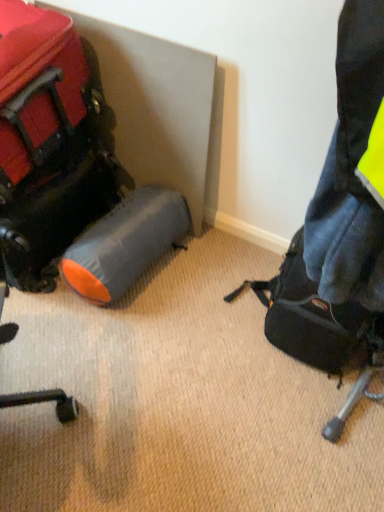
This screenshot has height=512, width=384. Describe the element at coordinates (49, 143) in the screenshot. I see `matte black suitcase at left, which ranks as the 2th luggage and bags in right-to-left order` at that location.

The width and height of the screenshot is (384, 512). In order to click on matte black backpack at right, the 1th luggage and bags positioned from the right in this screenshot , I will do `click(313, 318)`.

At what (x,y) coordinates should I click in order to perform the action: click on matte black suitcase at left, marked as the first luggage and bags in a left-to-right arrangement. Please return your answer as a coordinate pair (x, y). The image size is (384, 512). Looking at the image, I should click on [x=49, y=143].

Who is taller, matte black suitcase at left, marked as the first luggage and bags in a left-to-right arrangement, or gray fabric sleeping bag at lower left?

Standing taller between the two is matte black suitcase at left, marked as the first luggage and bags in a left-to-right arrangement.

From a real-world perspective, between matte black suitcase at left, marked as the first luggage and bags in a left-to-right arrangement, and gray fabric sleeping bag at lower left, who is vertically lower?

gray fabric sleeping bag at lower left.

Looking at this image, what's the angular difference between matte black suitcase at left, marked as the first luggage and bags in a left-to-right arrangement, and gray fabric sleeping bag at lower left's facing directions?

1.65 degrees.

Is matte black suitcase at left, which ranks as the 2th luggage and bags in right-to-left order, located outside gray fabric sleeping bag at lower left?

Yes, matte black suitcase at left, which ranks as the 2th luggage and bags in right-to-left order, is outside of gray fabric sleeping bag at lower left.

Locate an element on the screen. Image resolution: width=384 pixels, height=512 pixels. luggage below the matte black suitcase at left, marked as the first luggage and bags in a left-to-right arrangement (from the image's perspective) is located at coordinates (125, 243).

From a real-world perspective, between gray fabric sleeping bag at lower left and matte black suitcase at left, which ranks as the 2th luggage and bags in right-to-left order, who is vertically lower?

gray fabric sleeping bag at lower left, from a real-world perspective.

Can you confirm if gray fabric sleeping bag at lower left is wider than matte black suitcase at left, which ranks as the 2th luggage and bags in right-to-left order?

No.

Locate an element on the screen. The image size is (384, 512). luggage and bags above the matte black backpack at right, the 1th luggage and bags positioned from the right (from the image's perspective) is located at coordinates (49, 143).

Which of these two, matte black suitcase at left, marked as the first luggage and bags in a left-to-right arrangement, or matte black backpack at right, the 1th luggage and bags positioned from the right, stands shorter?

matte black backpack at right, the 1th luggage and bags positioned from the right, is shorter.

Is matte black suitcase at left, which ranks as the 2th luggage and bags in right-to-left order, to the left or to the right of matte black backpack at right, the 1th luggage and bags positioned from the right, in the image?

matte black suitcase at left, which ranks as the 2th luggage and bags in right-to-left order, is to the left of matte black backpack at right, the 1th luggage and bags positioned from the right.

Is matte black suitcase at left, which ranks as the 2th luggage and bags in right-to-left order, oriented away from matte black backpack at right, positioned as the 2th luggage and bags in left-to-right order?

That's not correct — matte black suitcase at left, which ranks as the 2th luggage and bags in right-to-left order, is not looking away from matte black backpack at right, positioned as the 2th luggage and bags in left-to-right order.

Can you confirm if matte black backpack at right, the 1th luggage and bags positioned from the right, is wider than matte black suitcase at left, which ranks as the 2th luggage and bags in right-to-left order?

No, matte black backpack at right, the 1th luggage and bags positioned from the right, is not wider than matte black suitcase at left, which ranks as the 2th luggage and bags in right-to-left order.

From a real-world perspective, does matte black backpack at right, positioned as the 2th luggage and bags in left-to-right order, stand above matte black suitcase at left, marked as the first luggage and bags in a left-to-right arrangement?

Actually, matte black backpack at right, positioned as the 2th luggage and bags in left-to-right order, is physically below matte black suitcase at left, marked as the first luggage and bags in a left-to-right arrangement, in the real world.

Does matte black backpack at right, positioned as the 2th luggage and bags in left-to-right order, contain matte black suitcase at left, which ranks as the 2th luggage and bags in right-to-left order?

Definitely not — matte black suitcase at left, which ranks as the 2th luggage and bags in right-to-left order, is not inside matte black backpack at right, positioned as the 2th luggage and bags in left-to-right order.

Considering the points (313, 328) and (112, 276), which point is in front, point (313, 328) or point (112, 276)?

Positioned in front is point (313, 328).

Is matte black backpack at right, positioned as the 2th luggage and bags in left-to-right order, wider than gray fabric sleeping bag at lower left?

No, matte black backpack at right, positioned as the 2th luggage and bags in left-to-right order, is not wider than gray fabric sleeping bag at lower left.

Considering the sizes of matte black backpack at right, positioned as the 2th luggage and bags in left-to-right order, and gray fabric sleeping bag at lower left in the image, is matte black backpack at right, positioned as the 2th luggage and bags in left-to-right order, bigger or smaller than gray fabric sleeping bag at lower left?

Considering their sizes, matte black backpack at right, positioned as the 2th luggage and bags in left-to-right order, takes up more space than gray fabric sleeping bag at lower left.

Is matte black backpack at right, positioned as the 2th luggage and bags in left-to-right order, placed right next to gray fabric sleeping bag at lower left?

No, matte black backpack at right, positioned as the 2th luggage and bags in left-to-right order, is not touching gray fabric sleeping bag at lower left.

Is there a large distance between gray fabric sleeping bag at lower left and matte black backpack at right, the 1th luggage and bags positioned from the right?

No.

Is gray fabric sleeping bag at lower left positioned before matte black backpack at right, the 1th luggage and bags positioned from the right?

No, the depth of gray fabric sleeping bag at lower left is greater than that of matte black backpack at right, the 1th luggage and bags positioned from the right.

Considering the relative positions of gray fabric sleeping bag at lower left and matte black backpack at right, positioned as the 2th luggage and bags in left-to-right order, in the image provided, is gray fabric sleeping bag at lower left to the right of matte black backpack at right, positioned as the 2th luggage and bags in left-to-right order, from the viewer's perspective?

In fact, gray fabric sleeping bag at lower left is to the left of matte black backpack at right, positioned as the 2th luggage and bags in left-to-right order.

Find the location of a particular element. luggage and bags lying below the gray fabric sleeping bag at lower left (from the image's perspective) is located at coordinates (313, 318).

Where is `luggage behind the matte black suitcase at left, marked as the first luggage and bags in a left-to-right arrangement`? Image resolution: width=384 pixels, height=512 pixels. luggage behind the matte black suitcase at left, marked as the first luggage and bags in a left-to-right arrangement is located at coordinates (125, 243).

Where is `luggage on the right of matte black suitcase at left, marked as the first luggage and bags in a left-to-right arrangement`? Image resolution: width=384 pixels, height=512 pixels. luggage on the right of matte black suitcase at left, marked as the first luggage and bags in a left-to-right arrangement is located at coordinates (125, 243).

Considering their positions, is matte black suitcase at left, marked as the first luggage and bags in a left-to-right arrangement, positioned closer to gray fabric sleeping bag at lower left than matte black backpack at right, positioned as the 2th luggage and bags in left-to-right order?

Among the two, matte black suitcase at left, marked as the first luggage and bags in a left-to-right arrangement, is located nearer to gray fabric sleeping bag at lower left.

Estimate the real-world distances between objects in this image. Which object is further from matte black suitcase at left, which ranks as the 2th luggage and bags in right-to-left order, matte black backpack at right, positioned as the 2th luggage and bags in left-to-right order, or gray fabric sleeping bag at lower left?

The object further to matte black suitcase at left, which ranks as the 2th luggage and bags in right-to-left order, is matte black backpack at right, positioned as the 2th luggage and bags in left-to-right order.

Consider the image. Which object lies nearer to the anchor point matte black backpack at right, the 1th luggage and bags positioned from the right, gray fabric sleeping bag at lower left or matte black suitcase at left, marked as the first luggage and bags in a left-to-right arrangement?

Among the two, gray fabric sleeping bag at lower left is located nearer to matte black backpack at right, the 1th luggage and bags positioned from the right.

Which object lies further to the anchor point matte black backpack at right, positioned as the 2th luggage and bags in left-to-right order, matte black suitcase at left, which ranks as the 2th luggage and bags in right-to-left order, or gray fabric sleeping bag at lower left?

matte black suitcase at left, which ranks as the 2th luggage and bags in right-to-left order, is further to matte black backpack at right, positioned as the 2th luggage and bags in left-to-right order.

Based on their spatial positions, is gray fabric sleeping bag at lower left or matte black backpack at right, positioned as the 2th luggage and bags in left-to-right order, further from matte black suitcase at left, marked as the first luggage and bags in a left-to-right arrangement?

matte black backpack at right, positioned as the 2th luggage and bags in left-to-right order, is positioned further to the anchor matte black suitcase at left, marked as the first luggage and bags in a left-to-right arrangement.

Estimate the real-world distances between objects in this image. Which object is closer to gray fabric sleeping bag at lower left, matte black backpack at right, the 1th luggage and bags positioned from the right, or matte black suitcase at left, marked as the first luggage and bags in a left-to-right arrangement?

Based on the image, matte black suitcase at left, marked as the first luggage and bags in a left-to-right arrangement, appears to be nearer to gray fabric sleeping bag at lower left.

Identify the location of luggage between matte black suitcase at left, marked as the first luggage and bags in a left-to-right arrangement, and matte black backpack at right, the 1th luggage and bags positioned from the right, in the horizontal direction. click(x=125, y=243).